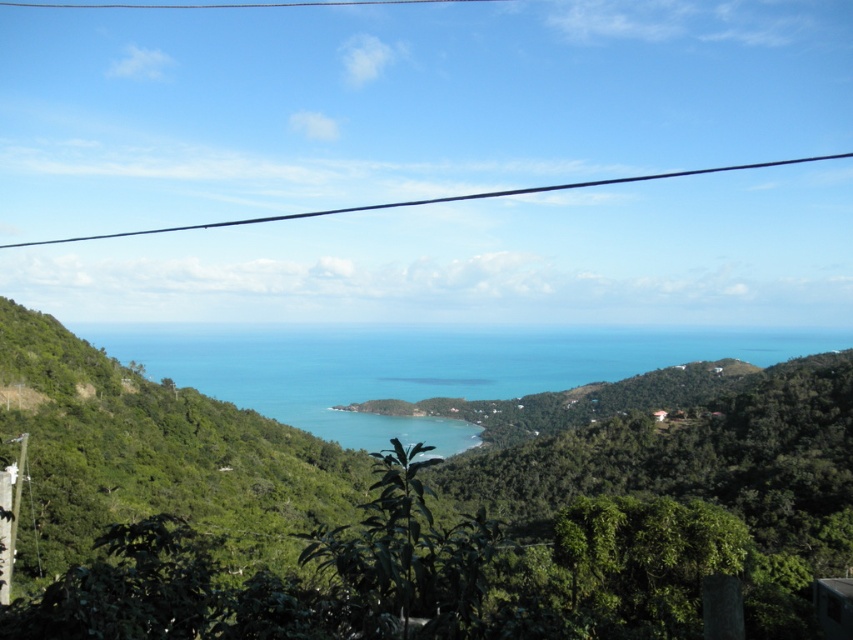
Does blue water at center have a larger size compared to black wire at upper center?

Correct, blue water at center is larger in size than black wire at upper center.

Is point (747, 340) more distant than point (796, 163)?

No, it is in front of (796, 163).

Does point (706, 336) lie behind point (498, 192)?

No.

Locate an element on the screen. The height and width of the screenshot is (640, 853). blue water at center is located at coordinates (421, 365).